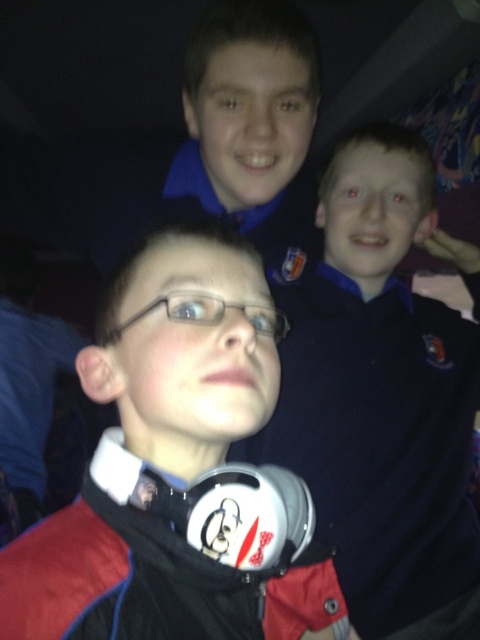
Looking at this image, which is above, matte black headphones at center or transparent plastic glasses at center?

transparent plastic glasses at center is above.

Describe the element at coordinates (179, 470) in the screenshot. This screenshot has height=640, width=480. I see `matte black headphones at center` at that location.

Between point (156, 358) and point (168, 296), which one is positioned in front?

Point (156, 358) is more forward.

Identify the location of matte black headphones at center. The image size is (480, 640). (179, 470).

Which is below, matte black shirt at upper right or transparent plastic glasses at center?

matte black shirt at upper right is lower down.

Is point (455, 490) farther from camera compared to point (204, 292)?

Yes, point (455, 490) is behind point (204, 292).

Image resolution: width=480 pixels, height=640 pixels. What are the coordinates of `matte black shirt at upper right` in the screenshot? It's located at (383, 396).

I want to click on matte black shirt at upper right, so click(x=383, y=396).

Between point (229, 348) and point (339, 554), which one is positioned in front?

Point (229, 348) is in front.

Does point (178, 326) come behind point (328, 221)?

That is False.

Identify the location of matte black headphones at center. (179, 470).